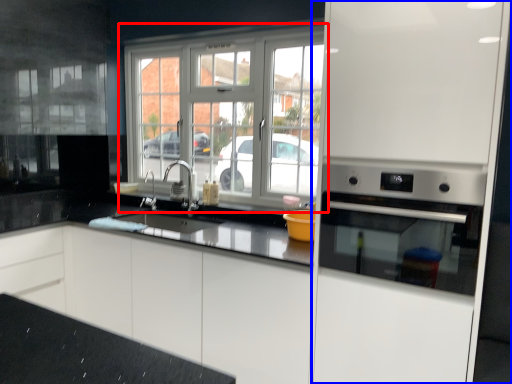
Question: Which point is closer to the camera, window (highlighted by a red box) or appliance (highlighted by a blue box)?

Choices:
 (A) window
 (B) appliance

Answer: (B)